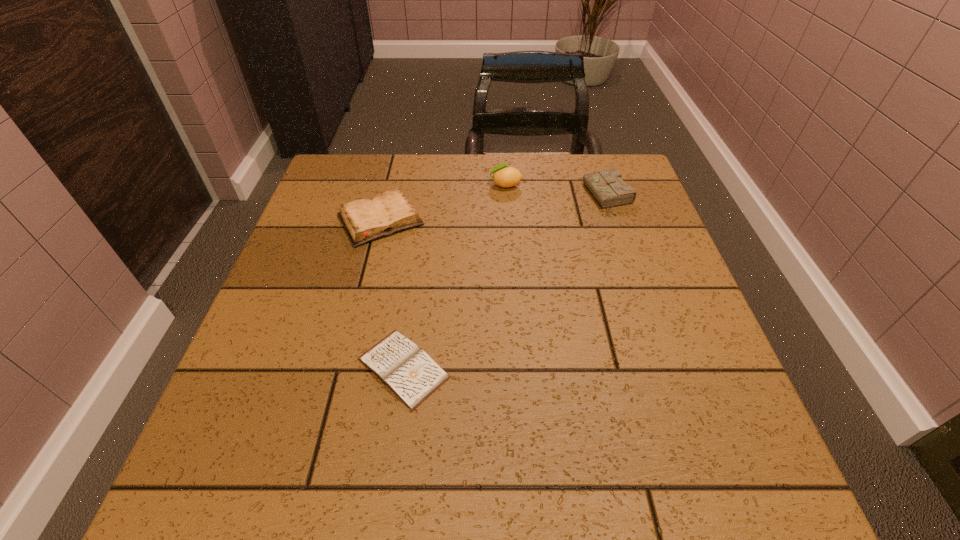
This screenshot has height=540, width=960. I want to click on vacant space situated on the front of the third tallest object, so click(364, 287).

This screenshot has height=540, width=960. I want to click on vacant region located on the back of the shortest object, so click(424, 219).

What are the coordinates of `lemon at the far edge` in the screenshot? It's located at tap(504, 176).

The width and height of the screenshot is (960, 540). Identify the location of object positioned at the left edge. (365, 220).

The height and width of the screenshot is (540, 960). Find the location of `object at the right edge`. object at the right edge is located at coordinates (607, 187).

Find the location of a particular element. This screenshot has height=540, width=960. object present at the far left corner is located at coordinates (365, 220).

At what (x,y) coordinates should I click in order to perform the action: click on object present at the far right corner. Please return your answer as a coordinate pair (x, y). This screenshot has height=540, width=960. Looking at the image, I should click on (607, 187).

Image resolution: width=960 pixels, height=540 pixels. Identify the location of blank space at the far edge of the desktop. (439, 156).

In order to click on vacant region at the left edge of the desktop in this screenshot , I will do `click(221, 422)`.

The image size is (960, 540). In order to click on vacant point at the right edge in this screenshot , I will do `click(640, 214)`.